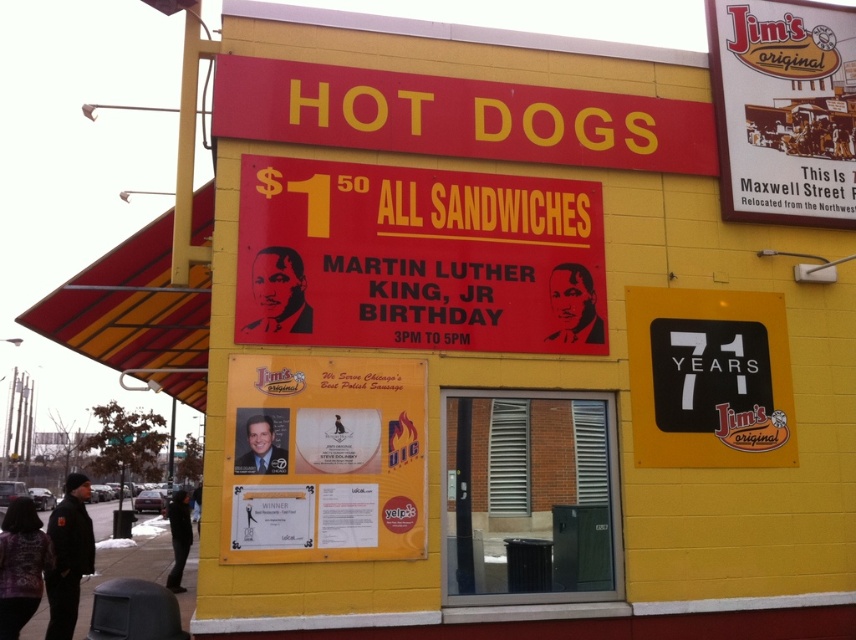
You are standing in front of the building and want to read both the matte yellow signboard at center and the black plastic sign at right. Which sign should you look at first to ensure you can see both clearly?

You should look at the matte yellow signboard at center first because it is closer to you than the black plastic sign at right, allowing you to see both signs clearly.